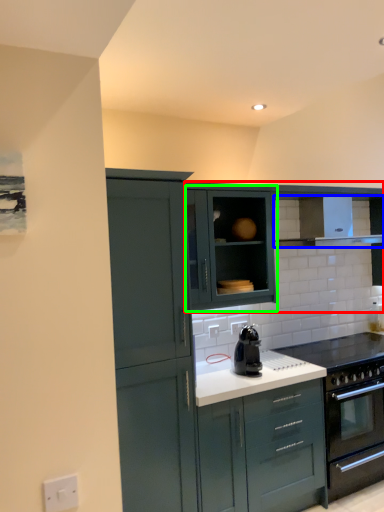
Question: Based on their relative distances, which object is nearer to cabinetry (highlighted by a red box)? Choose from exhaust hood (highlighted by a blue box) and cabinetry (highlighted by a green box).

Choices:
 (A) exhaust hood
 (B) cabinetry

Answer: (B)